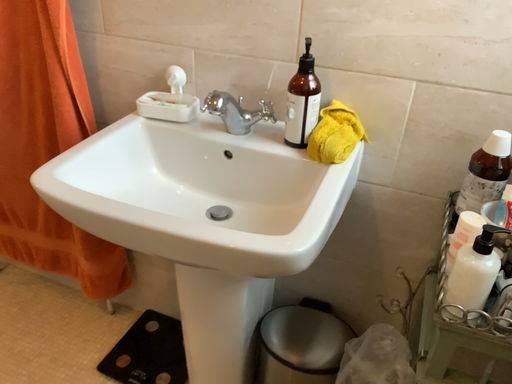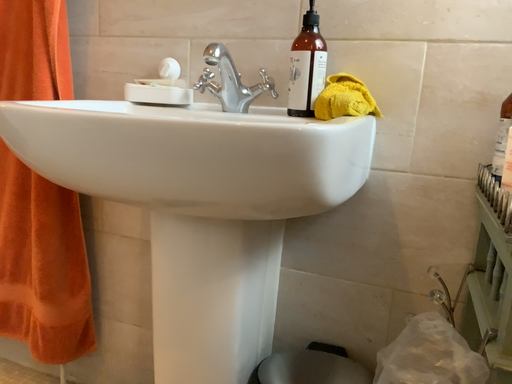
Question: How did the camera likely rotate when shooting the video?

Choices:
 (A) rotated downward
 (B) rotated upward

Answer: (B)